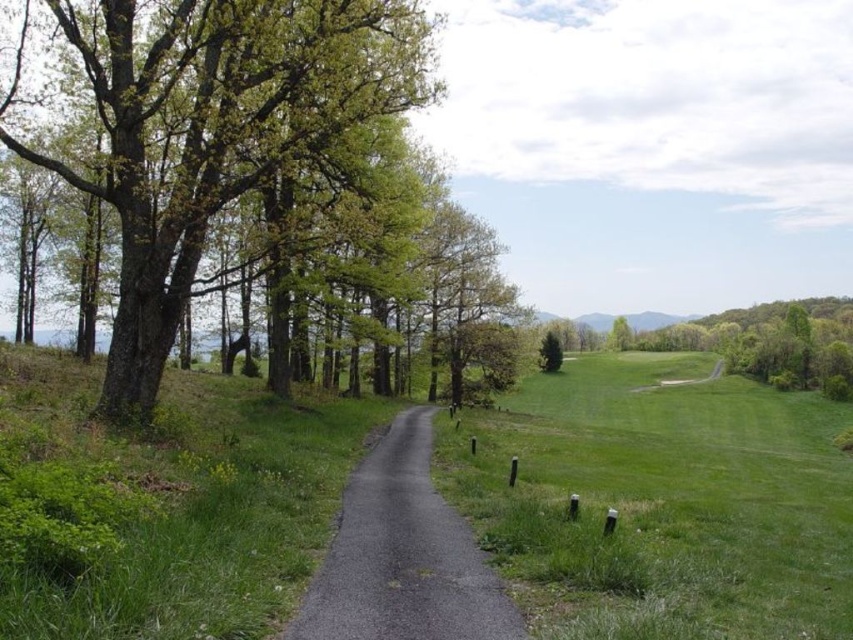
Question: Can you confirm if asphalt road at center is thinner than green matte tree at center?

Choices:
 (A) no
 (B) yes

Answer: (B)

Question: Which is farther from the green matte tree at center?

Choices:
 (A) asphalt road at center
 (B) green leafy tree at left
 (C) green leafy tree at center-right

Answer: (C)

Question: Is the position of asphalt road at center less distant than that of green leafy tree at center-right?

Choices:
 (A) yes
 (B) no

Answer: (A)

Question: Which object is closer to the camera taking this photo?

Choices:
 (A) green matte tree at center
 (B) asphalt road at center
 (C) green leafy tree at left
 (D) green leafy tree at center-right

Answer: (B)

Question: Is green leafy tree at left positioned in front of green matte tree at center?

Choices:
 (A) no
 (B) yes

Answer: (B)

Question: Which point is farther to the camera?

Choices:
 (A) (409, 534)
 (B) (409, 232)
 (C) (607, 337)

Answer: (C)